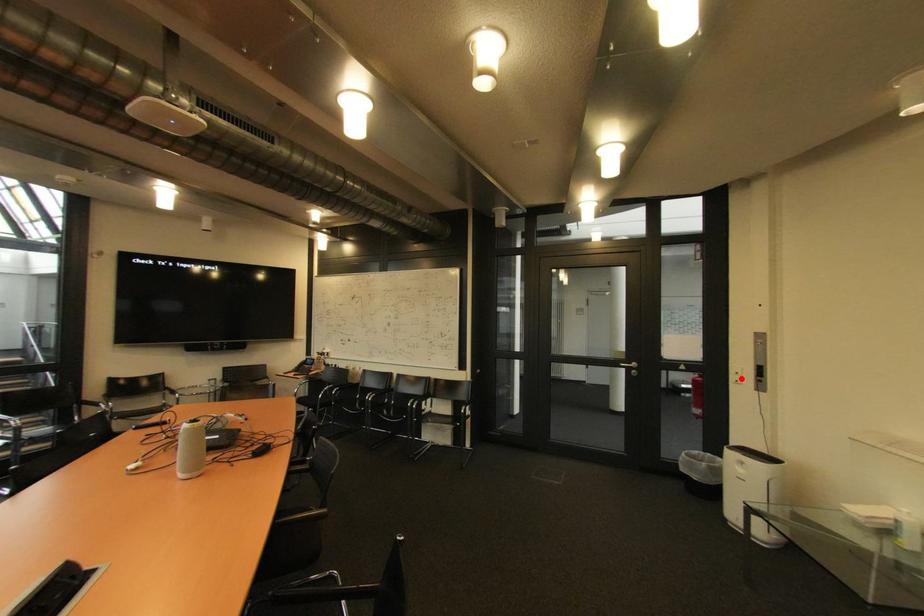
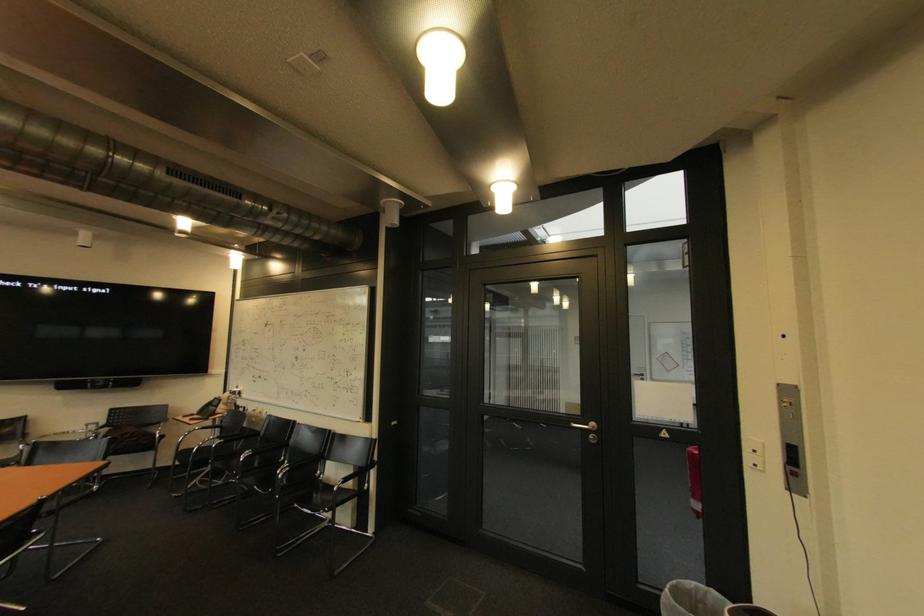
Question: I am providing you with two images of the same scene from different viewpoints. A red point is marked on the first image. Is the red point's position out of view in image 2?

Choices:
 (A) Yes
 (B) No

Answer: (B)